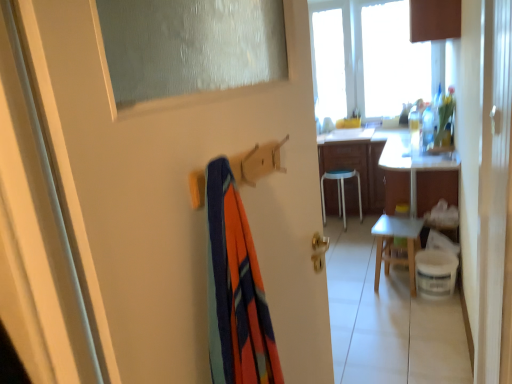
Find the location of `vacant area to the left of wooden chair at center`. vacant area to the left of wooden chair at center is located at coordinates (362, 291).